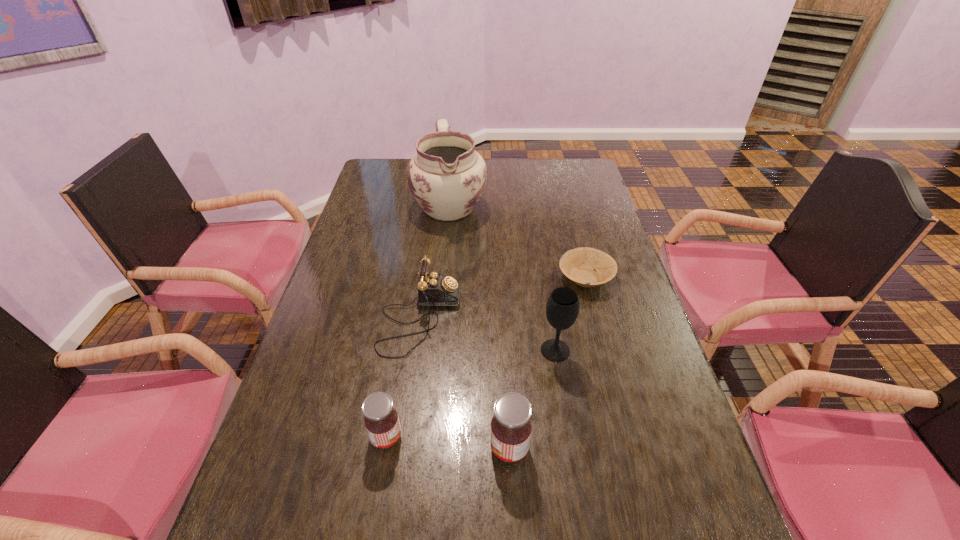
The width and height of the screenshot is (960, 540). Identify the location of empty location between the shorter jam and the taller jam. (447, 443).

The height and width of the screenshot is (540, 960). What are the coordinates of `free space between the second tallest object and the telephone` in the screenshot? It's located at (488, 334).

At what (x,y) coordinates should I click in order to perform the action: click on object that stands as the fourth closest to the right jam. Please return your answer as a coordinate pair (x, y). Looking at the image, I should click on (578, 264).

Where is `object identified as the fourth closest to the bowl`? The width and height of the screenshot is (960, 540). object identified as the fourth closest to the bowl is located at coordinates (511, 427).

The width and height of the screenshot is (960, 540). Find the location of `free space that satisfies the following two spatial constraints: 1. on the front side of the shortest object; 2. on the dial of the telephone`. free space that satisfies the following two spatial constraints: 1. on the front side of the shortest object; 2. on the dial of the telephone is located at coordinates 596,318.

Identify the location of vacant space that satisfies the following two spatial constraints: 1. on the front side of the fifth object from left to right; 2. on the label side of the left jam. (569, 437).

Image resolution: width=960 pixels, height=540 pixels. I want to click on free location that satisfies the following two spatial constraints: 1. on the front side of the bowl; 2. on the label side of the taller jam, so click(x=631, y=448).

Locate an element on the screen. This screenshot has height=540, width=960. free location that satisfies the following two spatial constraints: 1. on the spout of the pitcher; 2. on the label side of the shorter jam is located at coordinates point(427,437).

Image resolution: width=960 pixels, height=540 pixels. In order to click on free location that satisfies the following two spatial constraints: 1. on the spout of the farthest object; 2. on the label side of the shorter jam in this screenshot , I will do `click(427, 437)`.